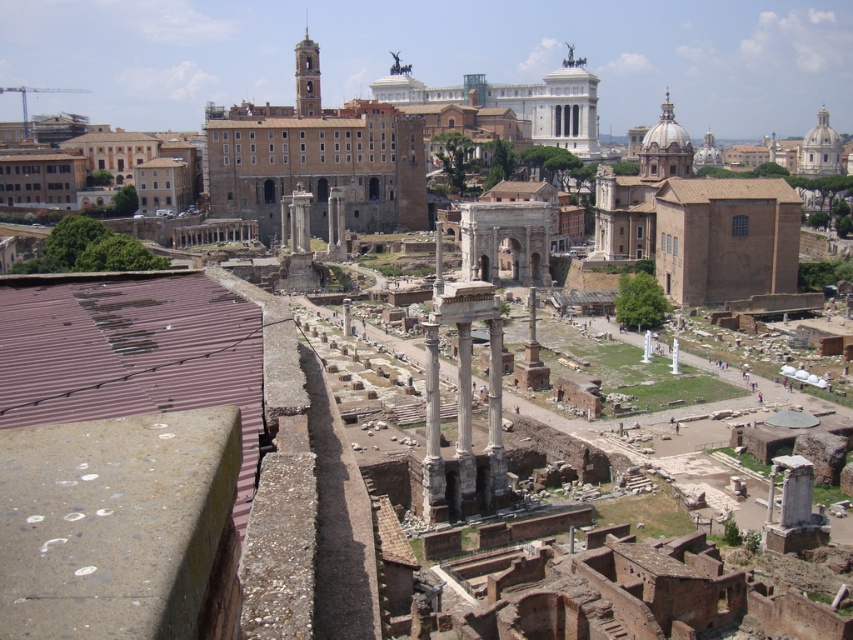
You are a tourist standing at the edge of the Roman Forum and want to take a photo that includes both the white marble column at center and the white glossy pillar at center. If your camera has a maximum zoom range that can capture objects up to 40 meters apart, will you be able to fit both in the same frame?

The white marble column at center is 44.64 meters from the white glossy pillar at center, which exceeds the camera maximum zoom range of 40 meters. Therefore, you won not be able to fit both in the same frame.

You are a tourist standing at the Roman Forum and want to take a photo of the white marble column at center and the smooth stone column at center. Which column should you focus on first to ensure both are in the frame?

You should focus on the white marble column at center first because it is in front of the smooth stone column at center, so by focusing on the closer one, both will be in focus.

You are a tourist standing at the edge of the Roman Forum and see the white marble column at center and the smooth stone column at center. Which one is positioned to the left?

The white marble column at center is positioned to the left of the smooth stone column at center.